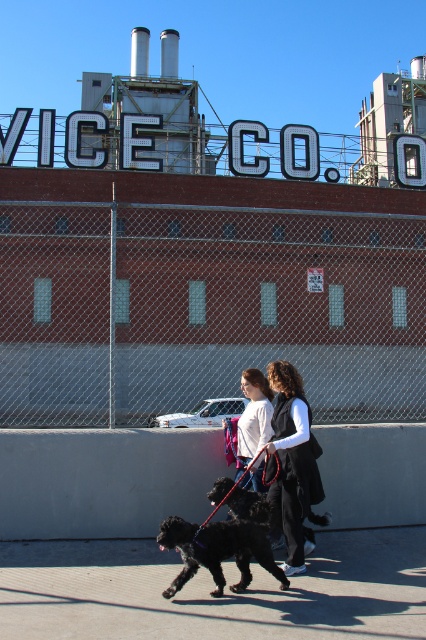
Question: Does white matte shirt at center lie behind black silky dog at center?

Choices:
 (A) yes
 (B) no

Answer: (A)

Question: Can you confirm if black fabric vest at center is smaller than white matte shirt at center?

Choices:
 (A) no
 (B) yes

Answer: (B)

Question: Which point is farther to the camera?

Choices:
 (A) smooth concrete sidewalk at lower center
 (B) shiny black dog at center
 (C) white matte shirt at center

Answer: (C)

Question: Among these points, which one is farthest from the camera?

Choices:
 (A) (192, 557)
 (B) (363, 630)

Answer: (A)

Question: Which is nearer to the black silky dog at center?

Choices:
 (A) smooth concrete sidewalk at lower center
 (B) black fabric vest at center
 (C) shiny black dog at center

Answer: (B)

Question: Can you confirm if black fabric vest at center is positioned above white matte shirt at center?

Choices:
 (A) yes
 (B) no

Answer: (B)